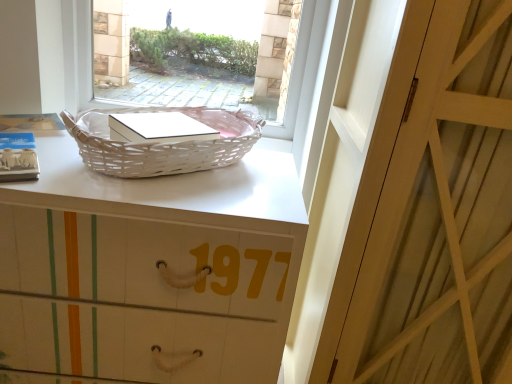
Question: From the image's perspective, would you say white wicker basket at upper center is shown under white wood door at center?

Choices:
 (A) yes
 (B) no

Answer: (B)

Question: Considering the relative sizes of white wicker basket at upper center and white wood door at center in the image provided, is white wicker basket at upper center thinner than white wood door at center?

Choices:
 (A) no
 (B) yes

Answer: (B)

Question: From the image's perspective, is white wicker basket at upper center located above white wood door at center?

Choices:
 (A) yes
 (B) no

Answer: (A)

Question: Is there a large distance between white wicker basket at upper center and white wood door at center?

Choices:
 (A) no
 (B) yes

Answer: (B)

Question: Considering the relative sizes of white wicker basket at upper center and white wood door at center in the image provided, is white wicker basket at upper center taller than white wood door at center?

Choices:
 (A) yes
 (B) no

Answer: (B)

Question: Do you think white wood door at center is within white wicker basket at upper center, or outside of it?

Choices:
 (A) outside
 (B) inside

Answer: (A)

Question: Looking at their shapes, would you say white wood door at center is wider or thinner than white wicker basket at upper center?

Choices:
 (A) wide
 (B) thin

Answer: (A)

Question: Considering the positions of white wood door at center and white wicker basket at upper center in the image, is white wood door at center bigger or smaller than white wicker basket at upper center?

Choices:
 (A) big
 (B) small

Answer: (A)

Question: In terms of height, does white wood door at center look taller or shorter compared to white wicker basket at upper center?

Choices:
 (A) tall
 (B) short

Answer: (A)

Question: Based on their sizes in the image, would you say white wicker picnic basket at upper left is bigger or smaller than white matte basket at upper center?

Choices:
 (A) small
 (B) big

Answer: (A)

Question: In terms of height, does white wicker picnic basket at upper left look taller or shorter compared to white matte basket at upper center?

Choices:
 (A) short
 (B) tall

Answer: (A)

Question: Is white wicker picnic basket at upper left to the left or to the right of white matte basket at upper center in the image?

Choices:
 (A) right
 (B) left

Answer: (A)

Question: Is white wicker picnic basket at upper left situated inside white matte basket at upper center or outside?

Choices:
 (A) inside
 (B) outside

Answer: (B)

Question: In the image, is white wicker picnic basket at upper left on the left side or the right side of white wicker basket at upper center?

Choices:
 (A) right
 (B) left

Answer: (A)

Question: Is white wicker picnic basket at upper left bigger or smaller than white wicker basket at upper center?

Choices:
 (A) small
 (B) big

Answer: (A)